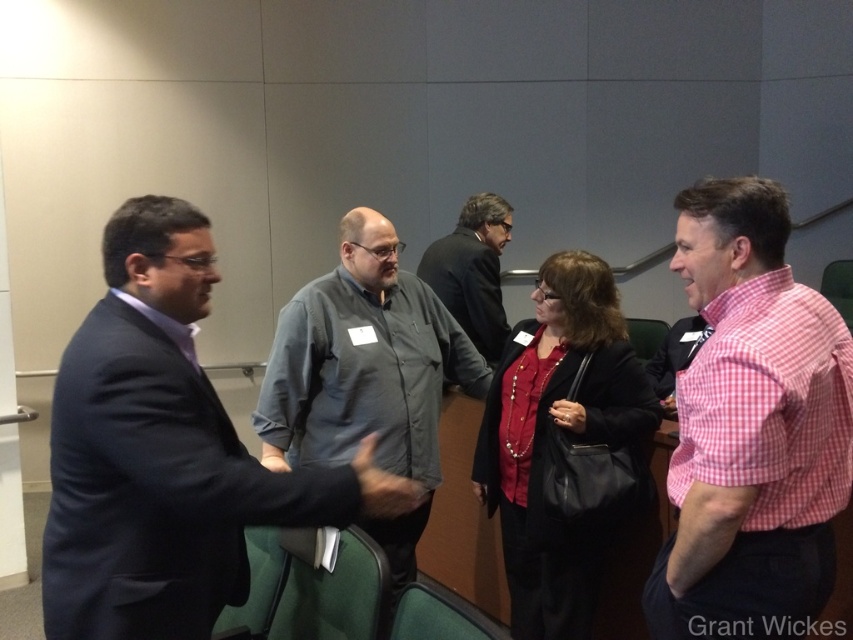
Question: Does dark blue suit at left appear over gray matte shirt at center?

Choices:
 (A) no
 (B) yes

Answer: (A)

Question: Among these points, which one is farthest from the camera?

Choices:
 (A) (775, 532)
 (B) (366, 234)
 (C) (479, 218)
 (D) (164, 564)

Answer: (C)

Question: Which object is positioned closest to the dark blue suit at left?

Choices:
 (A) pink checkered shirt at right
 (B) gray matte shirt at center

Answer: (B)

Question: Which point appears closest to the camera in this image?

Choices:
 (A) (488, 305)
 (B) (706, 461)

Answer: (B)

Question: Does pink checkered shirt at right have a smaller size compared to dark brown suit jacket at center?

Choices:
 (A) yes
 (B) no

Answer: (B)

Question: Does pink checkered shirt at right lie behind gray matte shirt at center?

Choices:
 (A) no
 (B) yes

Answer: (A)